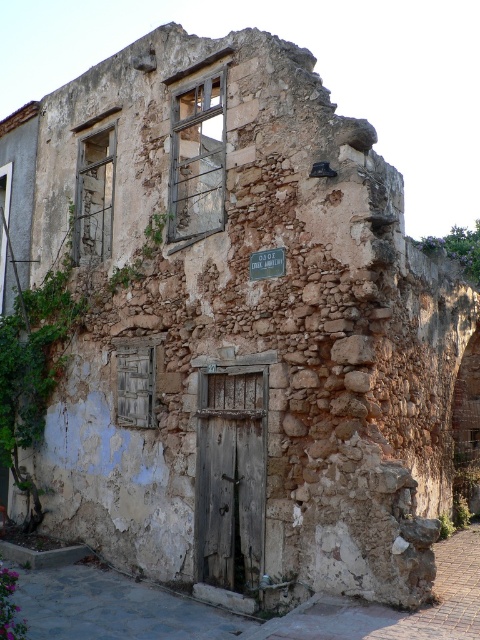
This screenshot has width=480, height=640. In order to click on wooden textured door at center in this screenshot , I will do `click(230, 477)`.

Is wooden textured door at center thinner than metallic rectangular sign at center?

Indeed, wooden textured door at center has a lesser width compared to metallic rectangular sign at center.

This screenshot has height=640, width=480. What do you see at coordinates (230, 477) in the screenshot?
I see `wooden textured door at center` at bounding box center [230, 477].

Locate an element on the screen. Image resolution: width=480 pixels, height=640 pixels. wooden textured door at center is located at coordinates (230, 477).